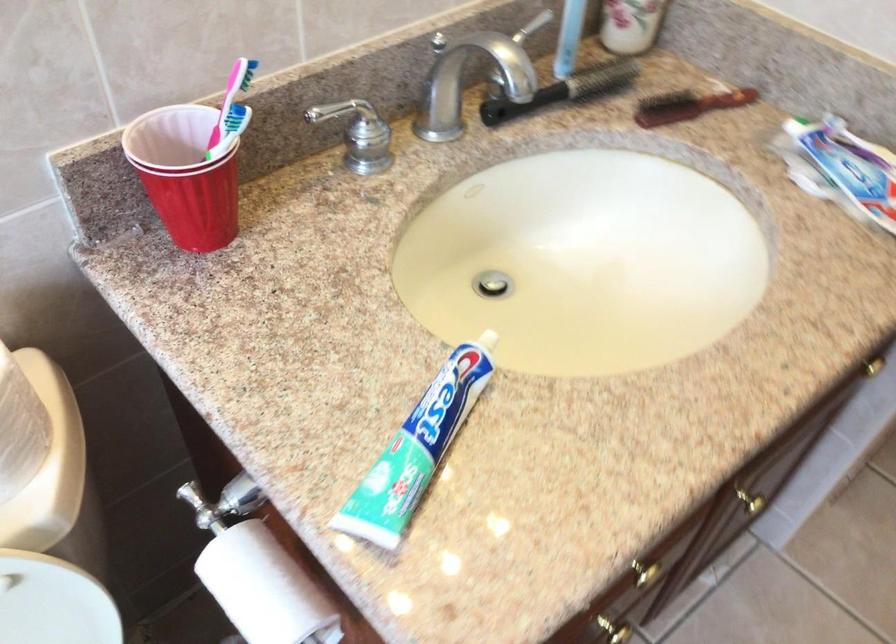
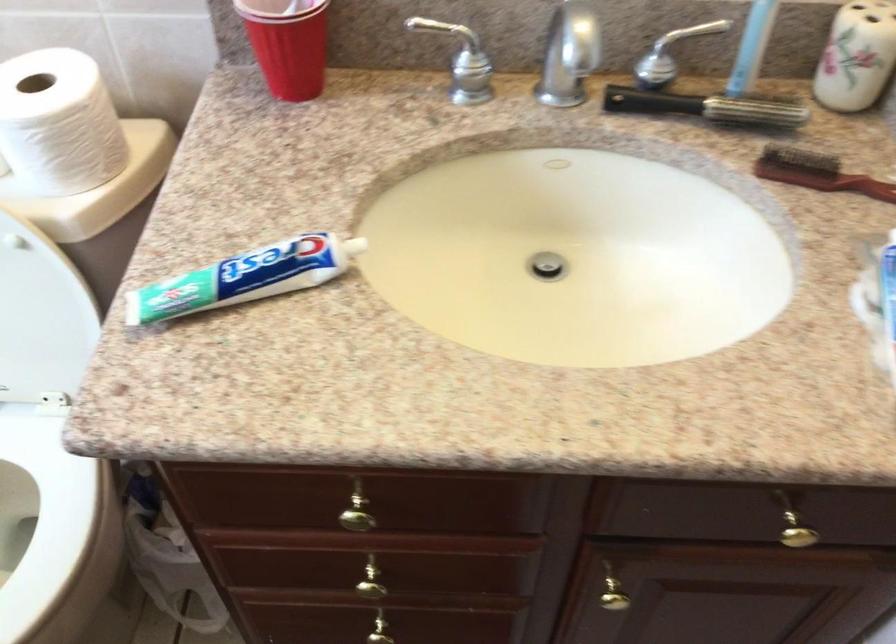
Where in the second image is the point corresponding to (650,567) from the first image?

(358, 509)